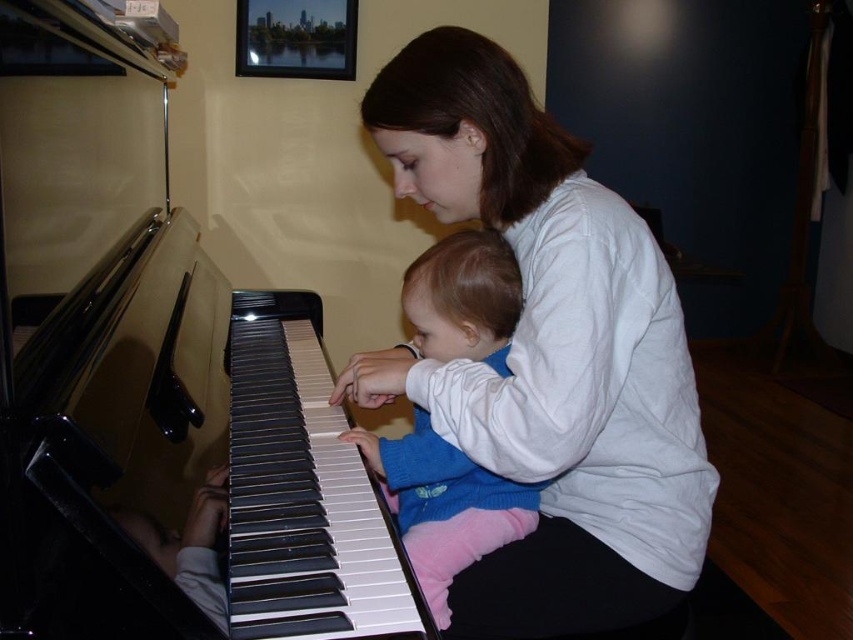
You are a photographer setting up for a photo shoot in this room. You need to position a light source so it illuminates both the black polished piano at left and the blue fleece sweater at center without casting shadows. Where should you place the light source relative to the objects?

The light source should be placed above both the black polished piano at left and the blue fleece sweater at center since the piano is located above the sweater, allowing the light to reach both without casting shadows.

You are a photographer setting up for a photo shoot in this room. You want to ensure that both the black polished piano at left and the blue fleece sweater at center are clearly visible in the shot. Given their sizes, which object should you focus on first to frame the composition properly?

The black polished piano at left has a larger size compared to the blue fleece sweater at center, so you should focus on framing the black polished piano at left first to ensure it is properly positioned in the composition.

You are standing in the room and looking at the two points marked in the image. Which point, point (633, 353) or point (318, 353), is closer to you?

Point (633, 353) is closer to you than point (318, 353).